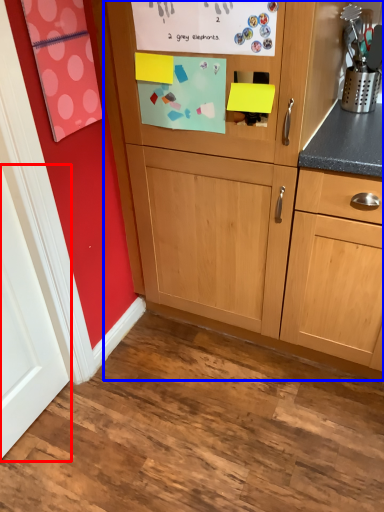
Question: Which of the following is the closest to the observer, door (highlighted by a red box) or cabinetry (highlighted by a blue box)?

Choices:
 (A) door
 (B) cabinetry

Answer: (A)